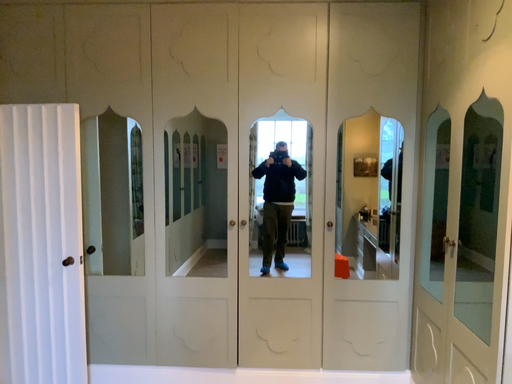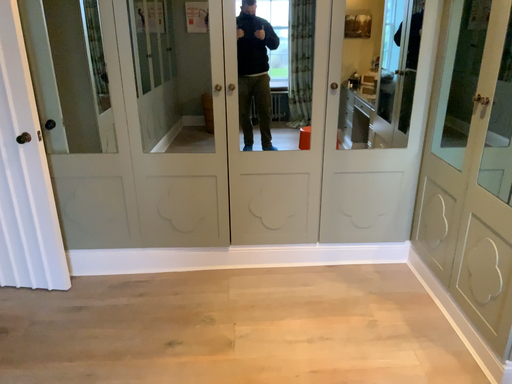
Question: Which way did the camera rotate in the video?

Choices:
 (A) rotated downward
 (B) rotated upward

Answer: (A)